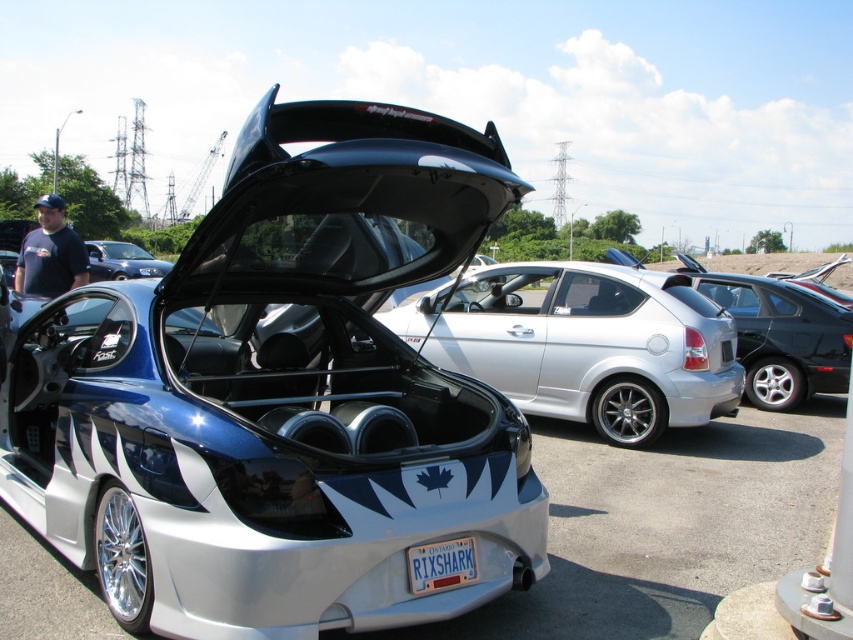
You are a photographer trying to capture the silver metallic hatchback at center and the white plastic license plate at center in the same frame. Which object should you zoom in on to ensure both fit in the shot without cropping?

You should zoom in on the white plastic license plate at center because the silver metallic hatchback at center is wider than the white plastic license plate at center, allowing the hatchback to remain in frame while focusing on the license plate.